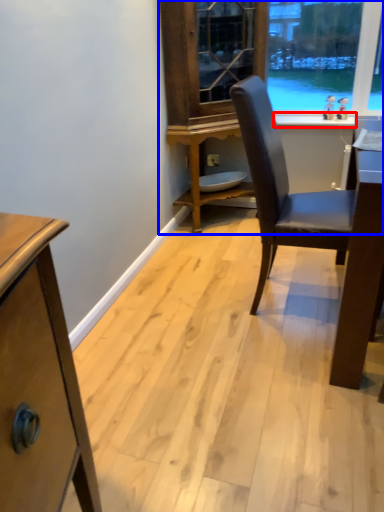
Question: Among these objects, which one is farthest to the camera, window sill (highlighted by a red box) or dresser (highlighted by a blue box)?

Choices:
 (A) window sill
 (B) dresser

Answer: (A)